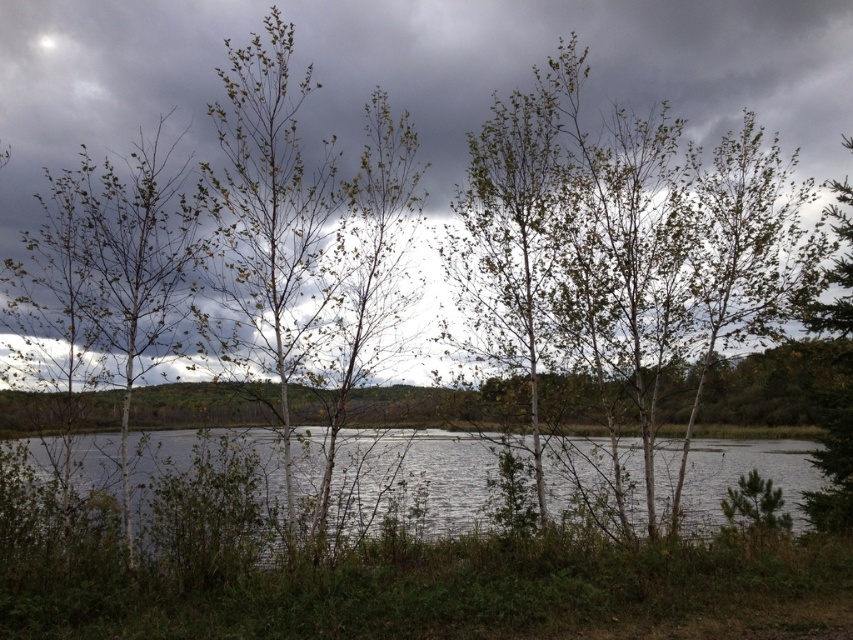
You are standing at the edge of the lake and want to take a photo of the point at coordinates point [462,172]. If your camera has a depth of field that can focus up to 30 feet, will the point be in focus?

The distance of point [462,172] from camera is 32.86 feet, which is beyond the camera focus limit of 30 feet. Therefore, the point will not be in focus.

You are standing in the serene natural landscape described. You want to take a photo of the gray cloudy sky at upper center. According to the coordinates provided, where exactly should you aim your camera?

You should aim your camera at point [413,72] to capture the gray cloudy sky at upper center.

You are standing at the edge of the lake and looking at the gray cloudy sky at upper center. If you want to take a photo of it with your phone, which has a maximum zoom range of 5 meters, will you be able to zoom in enough to capture the sky clearly?

The gray cloudy sky at upper center is 8.09 meters away from you. Since your phone can only zoom up to 5 meters, you won not be able to zoom in enough to capture the sky clearly.